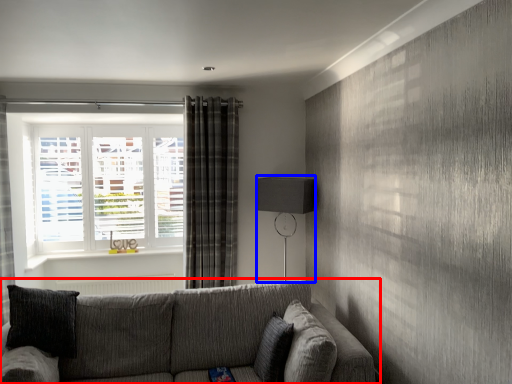
Question: Which object appears farthest to the camera in this image, studio couch (highlighted by a red box) or table lamp (highlighted by a blue box)?

Choices:
 (A) studio couch
 (B) table lamp

Answer: (B)